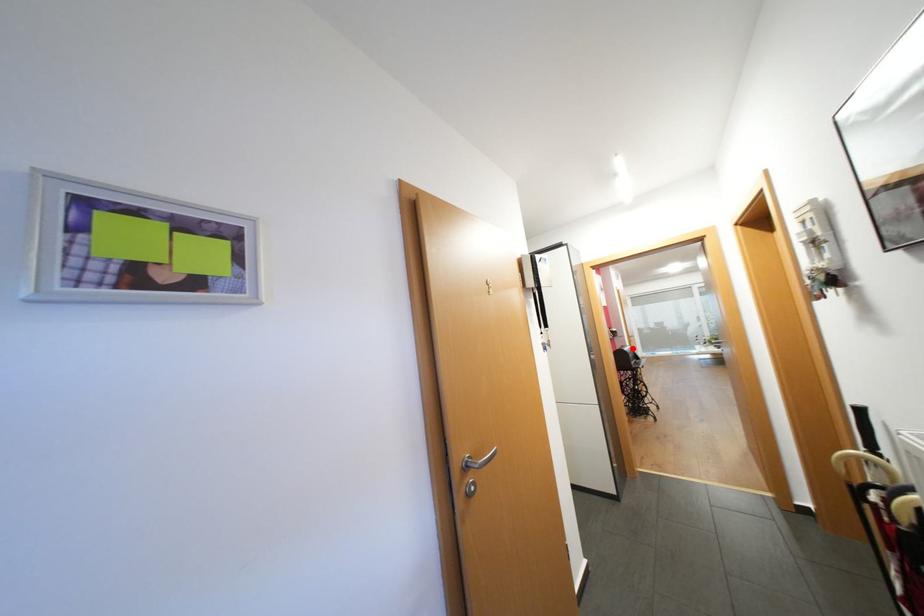
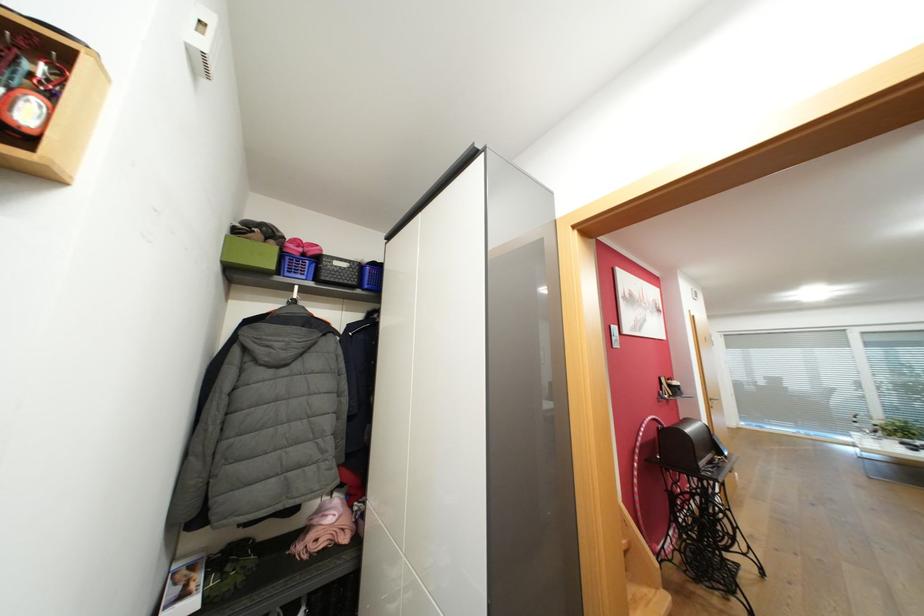
Locate, in the second image, the point that corresponds to the highlighted location in the first image.

(696, 430)